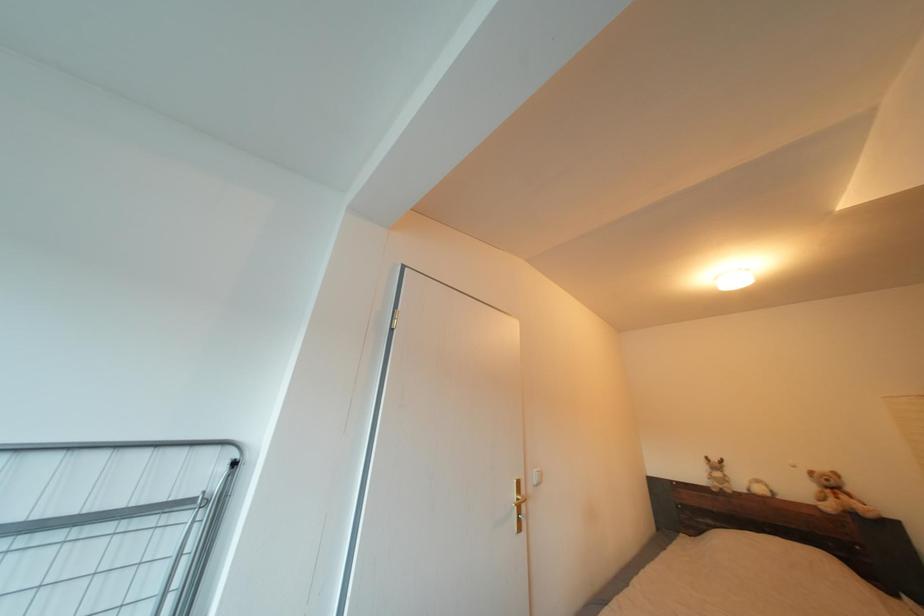
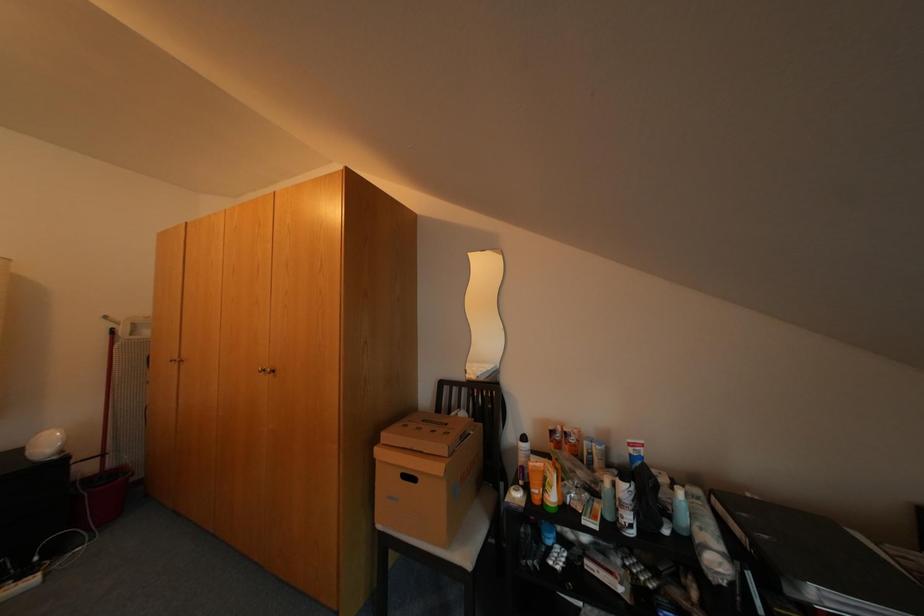
Question: The images are taken continuously from a first-person perspective. In which direction is your viewpoint rotating?

Choices:
 (A) Left
 (B) Right
 (C) Up
 (D) Down

Answer: (B)